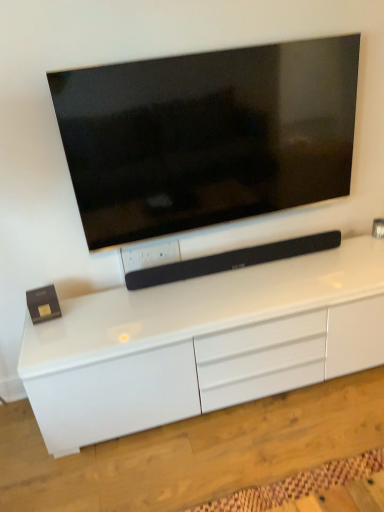
Locate an element on the screen. The height and width of the screenshot is (512, 384). empty space that is ontop of matte black tv at upper center (from a real-world perspective) is located at coordinates (220, 39).